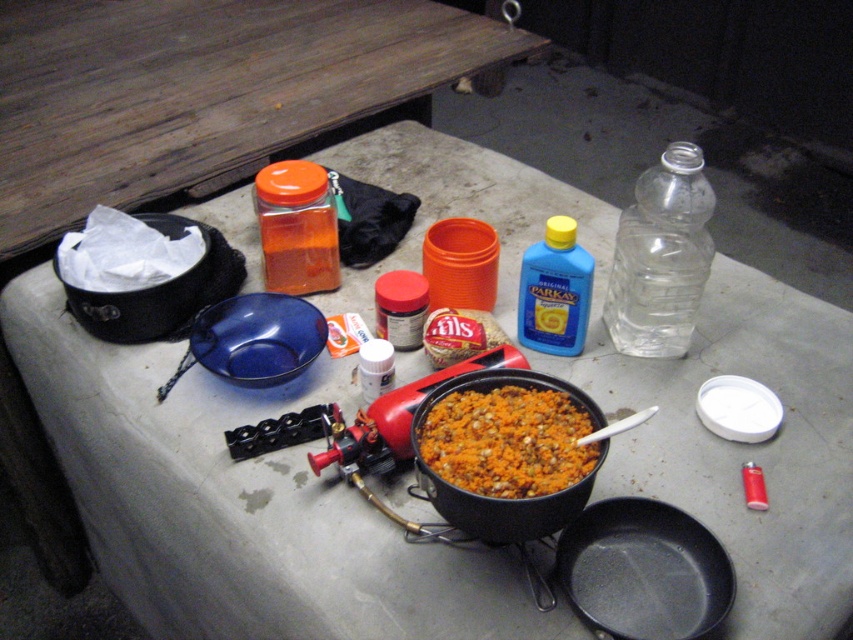
You are setting up a picnic and need to place the orange matte jar at center and the smooth brown bread at center on a table. Based on the scene, which item is positioned to the left of the other?

The orange matte jar at center is to the left of the smooth brown bread at center.

You are setting up a campsite kitchen and have a transparent plastic bottle at upper right and an orange matte jar at center. Which item is located to the right of the other?

The transparent plastic bottle at upper right is positioned on the right side of orange matte jar at center.